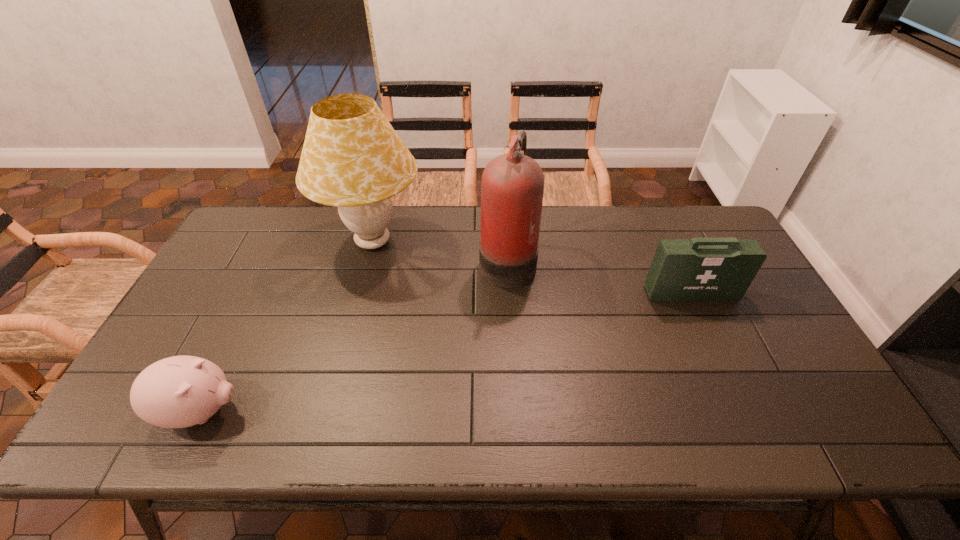
This screenshot has height=540, width=960. Identify the location of free space at the left edge of the desktop. (199, 314).

Where is `vacant space at the right edge of the desktop`? vacant space at the right edge of the desktop is located at coordinates (780, 343).

At what (x,y) coordinates should I click in order to perform the action: click on free location at the far left corner of the desktop. Please return your answer as a coordinate pair (x, y). This screenshot has height=540, width=960. Looking at the image, I should click on (266, 209).

Locate an element on the screen. Image resolution: width=960 pixels, height=540 pixels. free space at the near left corner is located at coordinates (111, 430).

Identify the location of vacant point located between the nearest object and the third object from left to right. (354, 335).

The height and width of the screenshot is (540, 960). I want to click on unoccupied area between the fire extinguisher and the lampshade, so click(440, 251).

Image resolution: width=960 pixels, height=540 pixels. Identify the location of vacant area that lies between the third object from right to left and the shortest object. (287, 326).

Find the location of `empty space that is in between the first-aid kit and the shortest object`. empty space that is in between the first-aid kit and the shortest object is located at coordinates (446, 352).

Find the location of a particular element. This screenshot has width=960, height=540. empty location between the leftmost object and the second object from right to left is located at coordinates (354, 335).

Where is `vacant space that's between the second object from right to left and the second shortest object`? The width and height of the screenshot is (960, 540). vacant space that's between the second object from right to left and the second shortest object is located at coordinates (599, 276).